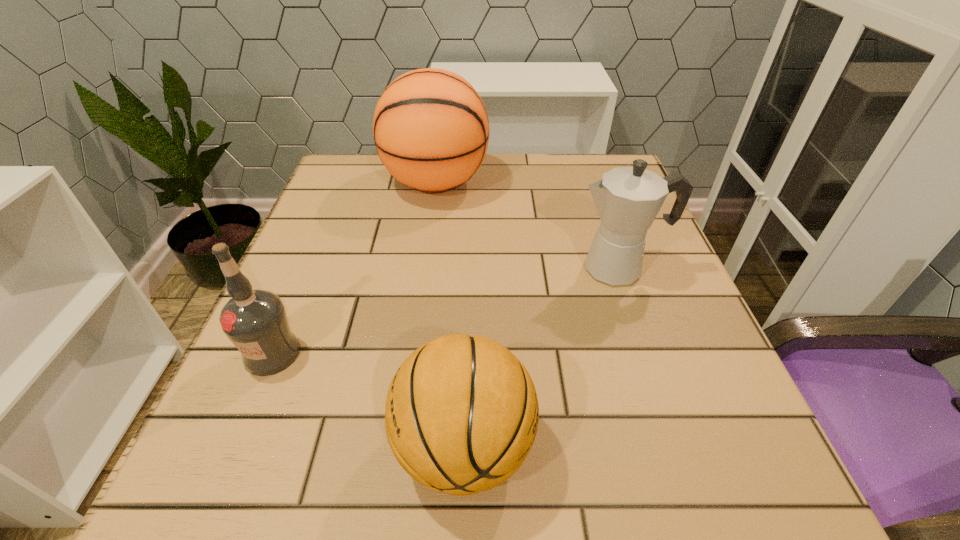
Identify the location of the taller basketball. This screenshot has width=960, height=540. (431, 130).

The image size is (960, 540). What are the coordinates of `the farthest object` in the screenshot? It's located at (431, 130).

You are a GUI agent. You are given a task and a screenshot of the screen. Output one action in this format:
    pyautogui.click(x=<x>, y=<y>)
    Task: Click on the third nearest object
    
    Given the screenshot: What is the action you would take?
    pyautogui.click(x=627, y=199)

At what (x,y) coordinates should I click in order to perform the action: click on the rightmost object. Please return your answer as a coordinate pair (x, y). The width and height of the screenshot is (960, 540). Looking at the image, I should click on (627, 199).

Find the location of a particular element. The image size is (960, 540). vodka is located at coordinates (255, 321).

Identify the location of the third farthest object. The image size is (960, 540). point(255,321).

Locate an element on the screen. The image size is (960, 540). the shortest object is located at coordinates (461, 415).

Find the location of a particular element. the nearer basketball is located at coordinates (461, 415).

Identify the location of vacant area located 0.170m on the front of the farthest object. click(424, 264).

Locate an element on the screen. The image size is (960, 540). vacant region located on the left of the rightmost object is located at coordinates (468, 269).